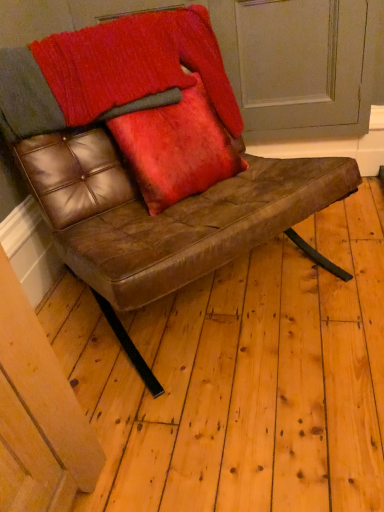
Question: Does point (71, 234) appear closer or farther from the camera than point (188, 150)?

Choices:
 (A) closer
 (B) farther

Answer: (A)

Question: Considering the positions of brown leather chair at center and velvet red cushion at center in the image, is brown leather chair at center taller or shorter than velvet red cushion at center?

Choices:
 (A) short
 (B) tall

Answer: (B)

Question: Considering the positions of brown leather chair at center and velvet red cushion at center in the image, is brown leather chair at center wider or thinner than velvet red cushion at center?

Choices:
 (A) wide
 (B) thin

Answer: (A)

Question: Relative to brown leather chair at center, is velvet red cushion at center in front or behind?

Choices:
 (A) front
 (B) behind

Answer: (B)

Question: From a real-world perspective, is velvet red cushion at center positioned above or below brown leather chair at center?

Choices:
 (A) below
 (B) above

Answer: (B)

Question: Is velvet red cushion at center inside or outside of brown leather chair at center?

Choices:
 (A) outside
 (B) inside

Answer: (B)

Question: In terms of width, does velvet red cushion at center look wider or thinner when compared to brown leather chair at center?

Choices:
 (A) thin
 (B) wide

Answer: (A)